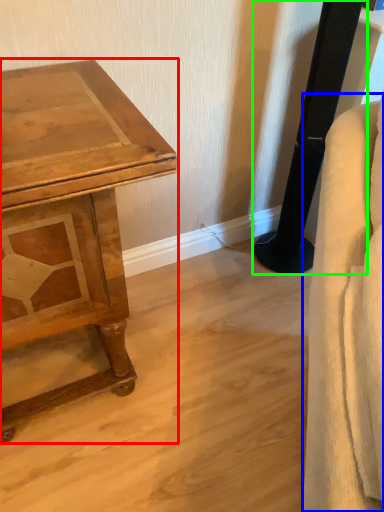
Question: Estimate the real-world distances between objects in this image. Which object is closer to table (highlighted by a red box), swivel chair (highlighted by a blue box) or pillar (highlighted by a green box)?

Choices:
 (A) swivel chair
 (B) pillar

Answer: (A)